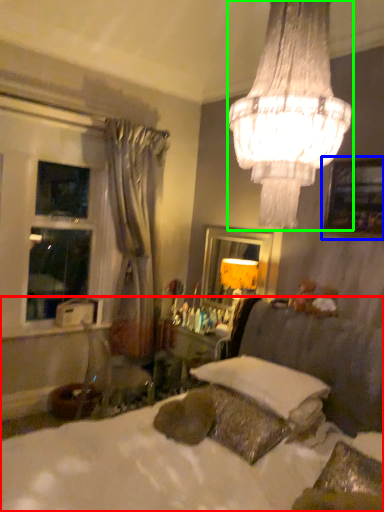
Question: Which object is the farthest from bed (highlighted by a red box)? Choose among these: picture frame (highlighted by a blue box) or lamp (highlighted by a green box).

Choices:
 (A) picture frame
 (B) lamp

Answer: (B)